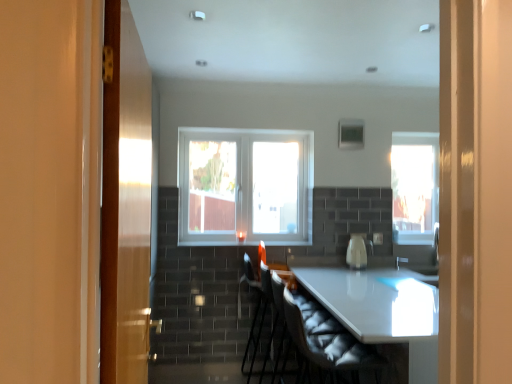
Question: Which direction should I rotate to look at velvet black armchair at center, the first armchair in the front-to-back sequence?

Choices:
 (A) left
 (B) right

Answer: (B)

Question: Is white glossy kettle at center positioned before white fabric swivel chair at center?

Choices:
 (A) no
 (B) yes

Answer: (A)

Question: Are white glossy kettle at center and white fabric swivel chair at center making contact?

Choices:
 (A) no
 (B) yes

Answer: (A)

Question: Can you confirm if white glossy kettle at center is positioned to the left of white fabric swivel chair at center?

Choices:
 (A) no
 (B) yes

Answer: (A)

Question: Can you confirm if white glossy kettle at center is bigger than white fabric swivel chair at center?

Choices:
 (A) no
 (B) yes

Answer: (A)

Question: Does white glossy kettle at center have a greater height compared to white fabric swivel chair at center?

Choices:
 (A) no
 (B) yes

Answer: (A)

Question: From a real-world perspective, is white glossy kettle at center on top of white fabric swivel chair at center?

Choices:
 (A) no
 (B) yes

Answer: (B)

Question: From the image's perspective, is white glossy table at center on white fabric swivel chair at center?

Choices:
 (A) yes
 (B) no

Answer: (B)

Question: Is white glossy table at center shorter than white fabric swivel chair at center?

Choices:
 (A) yes
 (B) no

Answer: (B)

Question: From the image's perspective, is white glossy table at center under white fabric swivel chair at center?

Choices:
 (A) yes
 (B) no

Answer: (A)

Question: Considering the relative sizes of white glossy table at center and white fabric swivel chair at center in the image provided, is white glossy table at center thinner than white fabric swivel chair at center?

Choices:
 (A) no
 (B) yes

Answer: (A)

Question: Considering the relative positions of white glossy table at center and white fabric swivel chair at center in the image provided, is white glossy table at center to the left of white fabric swivel chair at center from the viewer's perspective?

Choices:
 (A) no
 (B) yes

Answer: (A)

Question: Is white glossy table at center positioned far away from white fabric swivel chair at center?

Choices:
 (A) yes
 (B) no

Answer: (B)

Question: Does transparent glass window at right, which is the 2th window from front to back, have a lesser width compared to velvet black armchair at center, the first armchair in the front-to-back sequence?

Choices:
 (A) no
 (B) yes

Answer: (B)